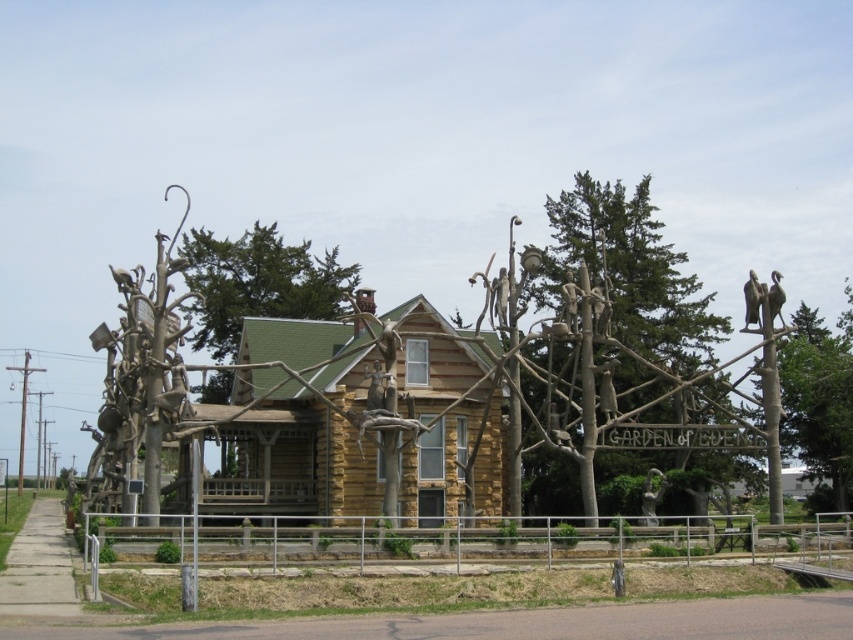
You are planning to place a new bench in the garden between the wooden log cabin at center and the polished bronze statue at center. Based on their widths, which object should the bench be closer to ensure it doesn

The wooden log cabin at center might be wider than the polished bronze statue at center, so the bench should be placed closer to the wooden log cabin at center to accommodate its greater width.

structural integrity of the wooden log cabin at center and polished bronze statue at center is a concern. Which one is more likely to be affected by heavy rain?

structural integrity of the wooden log cabin at center is more likely to be affected by heavy rain because wood is more susceptible to water damage than bronze.

You are an artist planning to move a new sculpture into the scene. You need to know which object occupies more horizontal space. Which is wider, the wooden sculpture at center or the green shingles at center?

The wooden sculpture at center is wider than the green shingles at center according to the description provided.